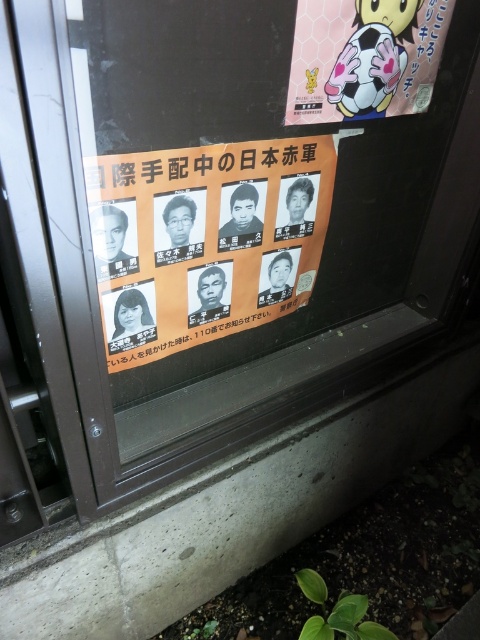
Which is behind, point (219, 188) or point (402, 36)?

Point (402, 36)

Does point (127, 269) lie behind point (396, 58)?

No, it is in front of (396, 58).

You are a GUI agent. You are given a task and a screenshot of the screen. Output one action in this format:
    pyautogui.click(x=<x>, y=<y>)
    Task: Click on the orange paper poster at center
    Image resolution: width=480 pixels, height=640 pixels.
    Given the screenshot: What is the action you would take?
    pyautogui.click(x=204, y=240)